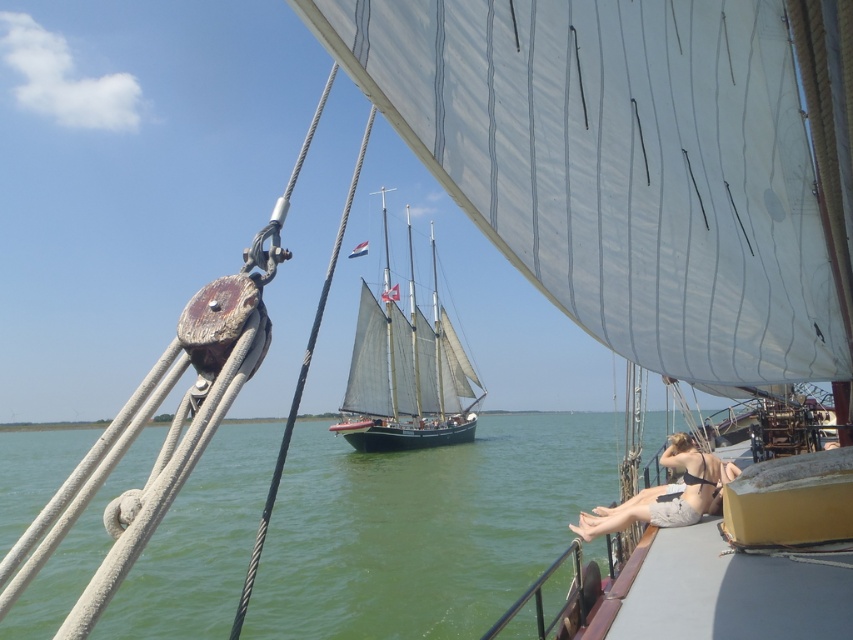
You are a photographer trying to capture a wide shot of the green water at lower center and the tan bikini top at center. Given that your camera can only focus on objects within a 3 meter width, will both objects fit in the frame?

The green water at lower center is wider than the tan bikini top at center. Since the camera can focus on objects within a 3 meter width, both objects will fit in the frame as their combined width does not exceed the limit.

You are standing on the deck of the sailboat in the foreground. You notice a point marked at coordinates (424, 528). What is located at this point?

The point at coordinates (424, 528) indicates green water at lower center.

You are a photographer trying to capture the tan bikini top at center and the dark blue wooden sailboat at center in the same frame. Which object is closer to you, and will it block your view of the other?

The dark blue wooden sailboat at center is closer to you than the tan bikini top at center, so it will block your view of the tan bikini top at center.